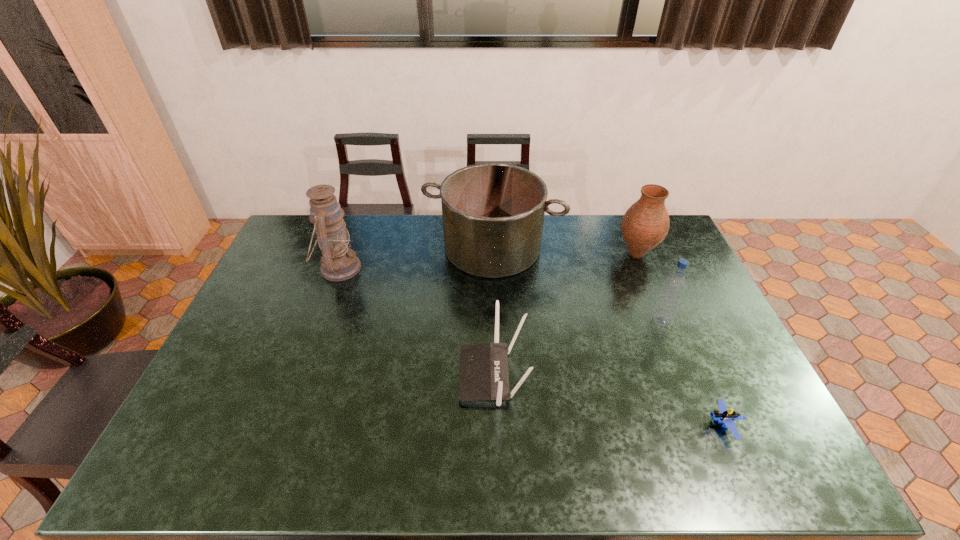
At what (x,y) coordinates should I click in order to perform the action: click on object that is positioned at the near edge. Please return your answer as a coordinate pair (x, y). Looking at the image, I should click on (722, 415).

Find the location of a particular element. vase located at the right edge is located at coordinates tap(646, 223).

Find the location of a particular element. This screenshot has height=540, width=960. water bottle at the right edge is located at coordinates (674, 285).

The width and height of the screenshot is (960, 540). In order to click on Lego present at the right edge in this screenshot , I will do `click(722, 415)`.

Locate an element on the screen. Image resolution: width=960 pixels, height=540 pixels. object that is positioned at the far right corner is located at coordinates (646, 223).

Find the location of a particular element. object that is positioned at the near right corner is located at coordinates (722, 415).

Where is `blank space at the far edge of the desktop`? blank space at the far edge of the desktop is located at coordinates (398, 221).

Image resolution: width=960 pixels, height=540 pixels. Find the location of `vacant space at the near edge`. vacant space at the near edge is located at coordinates (601, 475).

This screenshot has width=960, height=540. In the image, there is a desktop. Identify the location of vacant region at the left edge. (242, 321).

This screenshot has width=960, height=540. In the image, there is a desktop. In order to click on vacant space at the right edge in this screenshot , I will do `click(713, 376)`.